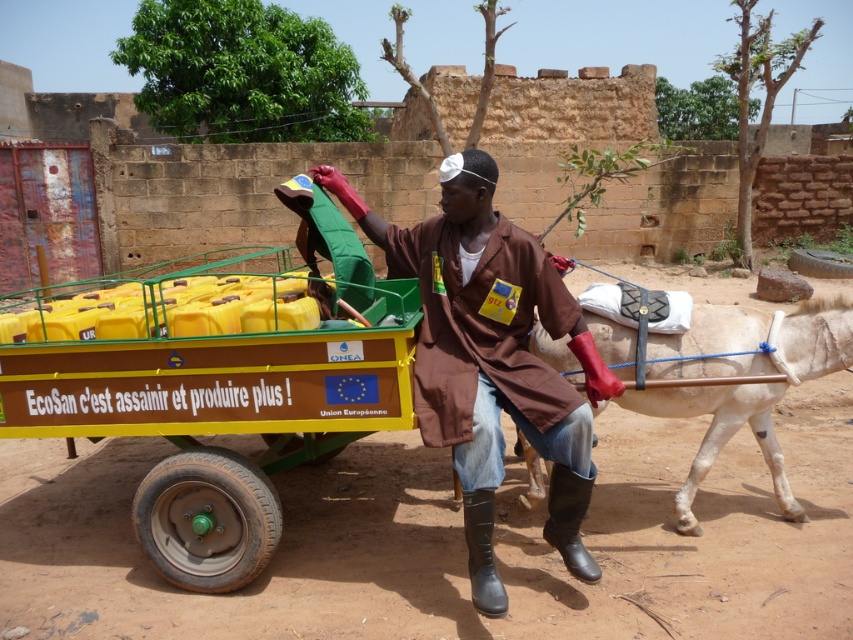
Consider the image. Is brown fabric coat at center bigger than white smooth mule at lower right?

Indeed, brown fabric coat at center has a larger size compared to white smooth mule at lower right.

Who is positioned more to the left, brown fabric coat at center or white smooth mule at lower right?

brown fabric coat at center

You are a GUI agent. You are given a task and a screenshot of the screen. Output one action in this format:
    pyautogui.click(x=<x>, y=<y>)
    Task: Click on the brown fabric coat at center
    
    Given the screenshot: What is the action you would take?
    pyautogui.click(x=491, y=356)

Image resolution: width=853 pixels, height=640 pixels. I want to click on brown fabric coat at center, so pos(491,356).